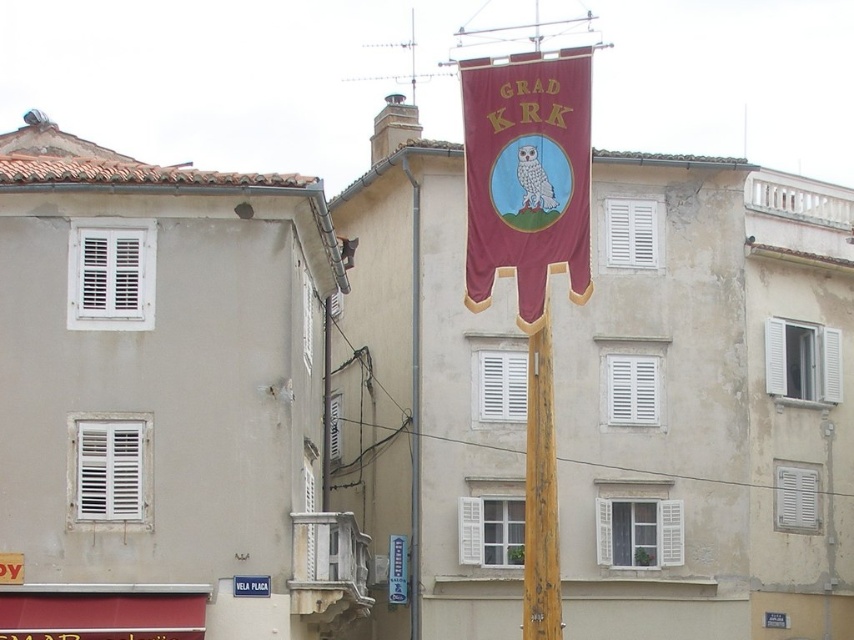
Which of these two, maroon fabric banner at center or white plastic street sign at center, stands taller?

Standing taller between the two is white plastic street sign at center.

Between maroon fabric banner at center and white plastic street sign at center, which one has less height?

maroon fabric banner at center

Does point (474, 224) lie in front of point (390, 545)?

That is True.

Where is `maroon fabric banner at center`? maroon fabric banner at center is located at coordinates (527, 176).

Consider the image. Is maroon fabric banner at center below wooden pole at center?

No, maroon fabric banner at center is not below wooden pole at center.

Is point (571, 204) positioned in front of point (550, 618)?

No, it is not.

The width and height of the screenshot is (854, 640). Identify the location of maroon fabric banner at center. (527, 176).

Is wooden pole at center shorter than white plastic street sign at center?

No.

Is wooden pole at center taller than white plastic street sign at center?

Yes.

Locate an element on the screen. The width and height of the screenshot is (854, 640). wooden pole at center is located at coordinates (540, 497).